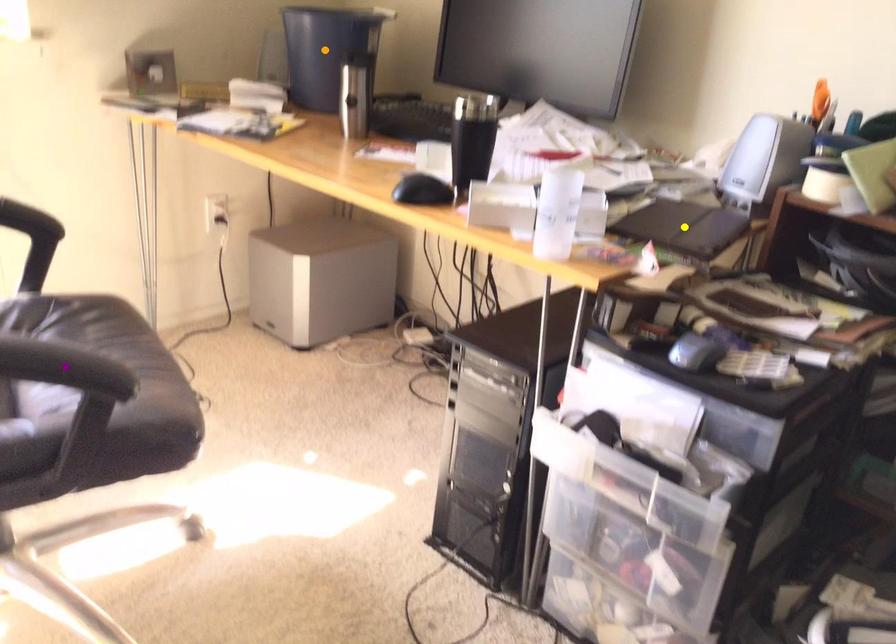
Order these from nearest to farthest:
A) purple point
B) yellow point
C) orange point

purple point, yellow point, orange point